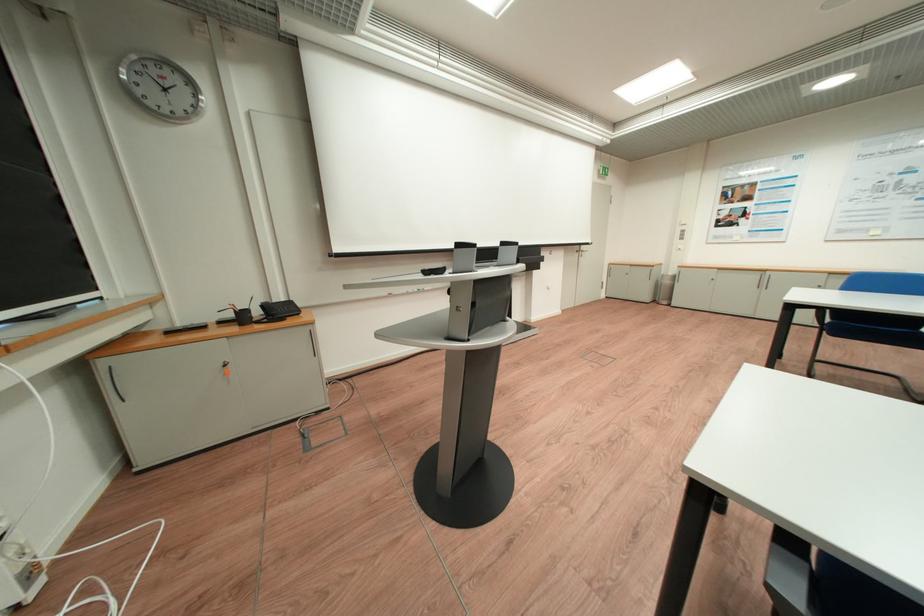
Identify the location of white light switch. The image size is (924, 616). (682, 233).